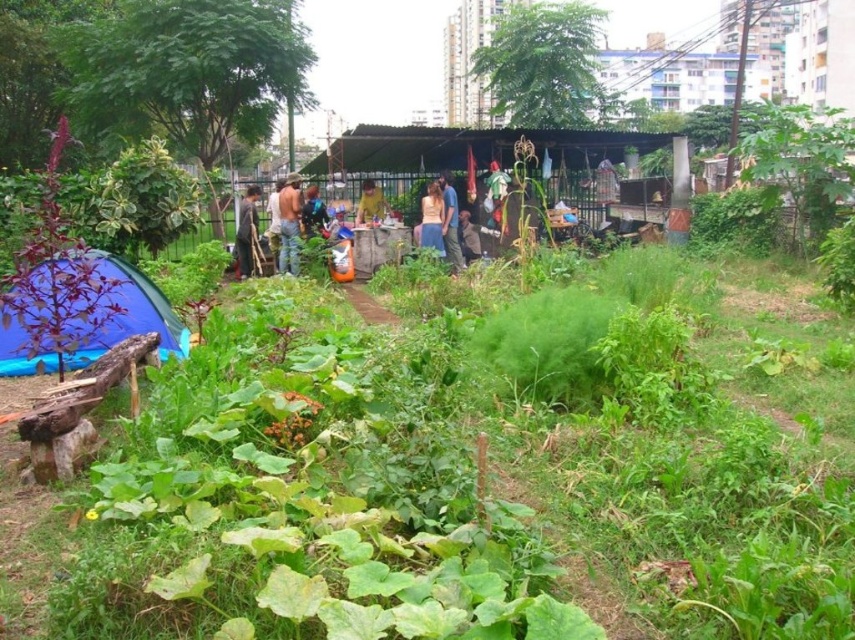
Question: Which of these objects is positioned closest to the blue fabric at center?

Choices:
 (A) denim jacket at center
 (B) brown fabric shirt at center

Answer: (A)

Question: Is brown leather jacket at center closer to camera compared to denim jacket at center?

Choices:
 (A) yes
 (B) no

Answer: (A)

Question: Is brown denim pants at center thinner than yellow shirt at center?

Choices:
 (A) no
 (B) yes

Answer: (B)

Question: Which point is closer to the camera?

Choices:
 (A) (276, 243)
 (B) (313, 227)
 (C) (281, 225)
 (D) (467, 225)

Answer: (C)

Question: Which point is closer to the camera?

Choices:
 (A) light brown fabric shirt at center
 (B) brown leather jacket at center

Answer: (A)

Question: Does brown leather jacket at center lie in front of light brown fabric shirt at center?

Choices:
 (A) no
 (B) yes

Answer: (A)